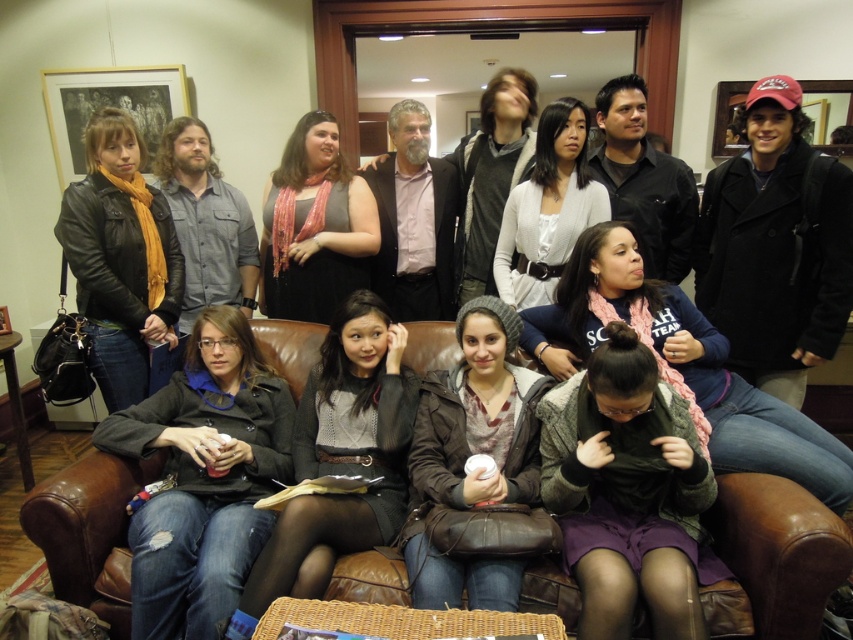
You are a photographer trying to capture a closeup shot of the two gray items at the center of the image. Given that your camera can only focus on objects wider than 10 cm, will both the matte gray sweater at center and the knitted gray beanie at center be in focus?

The matte gray sweater at center has a width less than the knitted gray beanie at center. Since the camera requires objects wider than 10 cm to focus, only the knitted gray beanie at center will be in focus if its width exceeds 10 cm. However, without knowing the exact width of the sweater, we can confirm the beanie is wider than the sweater. If the sweater is under 10 cm, it won question. But the answer should be based on the given info. Wait, the description says the sweater is less than the beanie. If be

You are a photographer setting up for a group photo. You notice the pink scarf at center and the leather jacket at left in the frame. Which object appears shorter in the photo?

The pink scarf at center appears shorter than the leather jacket at left because it is not as tall as the jacket.